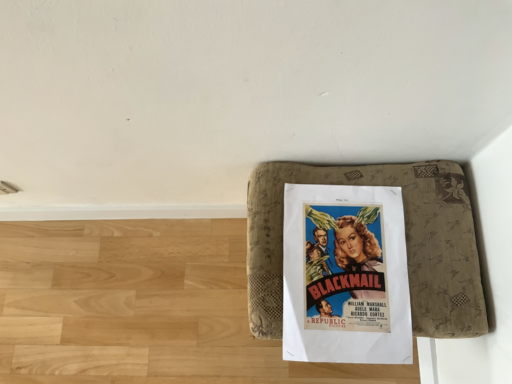
Describe the element at coordinates (345, 275) in the screenshot. I see `matte paper poster at center` at that location.

Where is `matte paper poster at center`? matte paper poster at center is located at coordinates (345, 275).

Find the location of `matte paper poster at center`. matte paper poster at center is located at coordinates (345, 275).